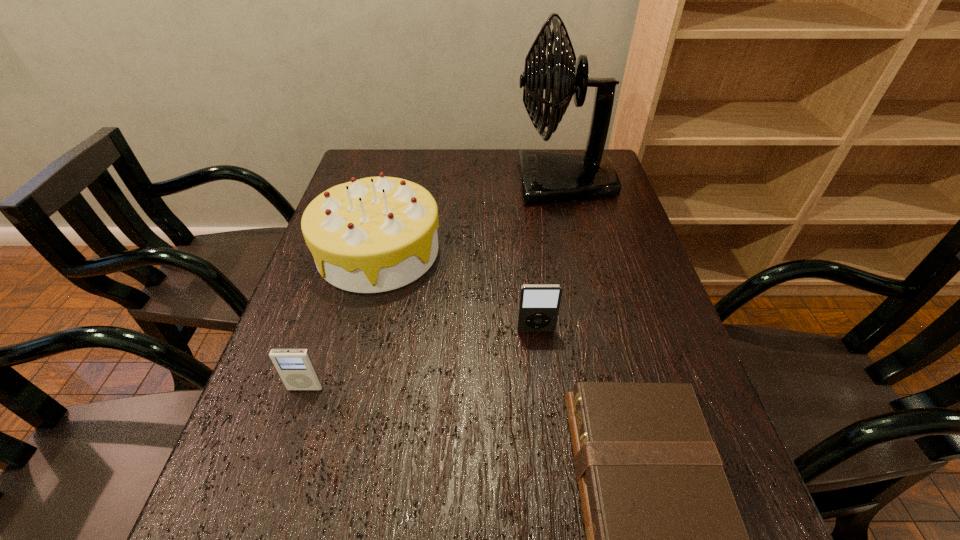
Identify the location of vacant space located 0.340m in front of the farthest object to blow air. The width and height of the screenshot is (960, 540). (405, 183).

This screenshot has width=960, height=540. What are the coordinates of `vacant space situated on the right of the fourth nearest object` in the screenshot? It's located at (525, 251).

Locate an element on the screen. The image size is (960, 540). vacant space situated on the front-facing side of the third nearest object is located at coordinates (542, 390).

Where is `vacant space situated 0.190m on the front-facing side of the left iPod`? vacant space situated 0.190m on the front-facing side of the left iPod is located at coordinates (271, 495).

Locate an element on the screen. The height and width of the screenshot is (540, 960). object situated at the far edge is located at coordinates (546, 177).

I want to click on birthday cake present at the left edge, so click(x=375, y=234).

I want to click on iPod located in the left edge section of the desktop, so click(x=296, y=367).

You are a GUI agent. You are given a task and a screenshot of the screen. Output one action in this format:
    pyautogui.click(x=<x>, y=<y>)
    Task: Click on the object that is positioned at the right edge
    The width and height of the screenshot is (960, 540).
    Given the screenshot: What is the action you would take?
    pyautogui.click(x=546, y=177)

You are a GUI agent. You are given a task and a screenshot of the screen. Output one action in this format:
    pyautogui.click(x=<x>, y=<y>)
    Task: Click on the object present at the far right corner
    The image size is (960, 540).
    Given the screenshot: What is the action you would take?
    pyautogui.click(x=546, y=177)

In the image, there is a desktop. Where is `vacant region at the far edge`? The height and width of the screenshot is (540, 960). vacant region at the far edge is located at coordinates (506, 179).